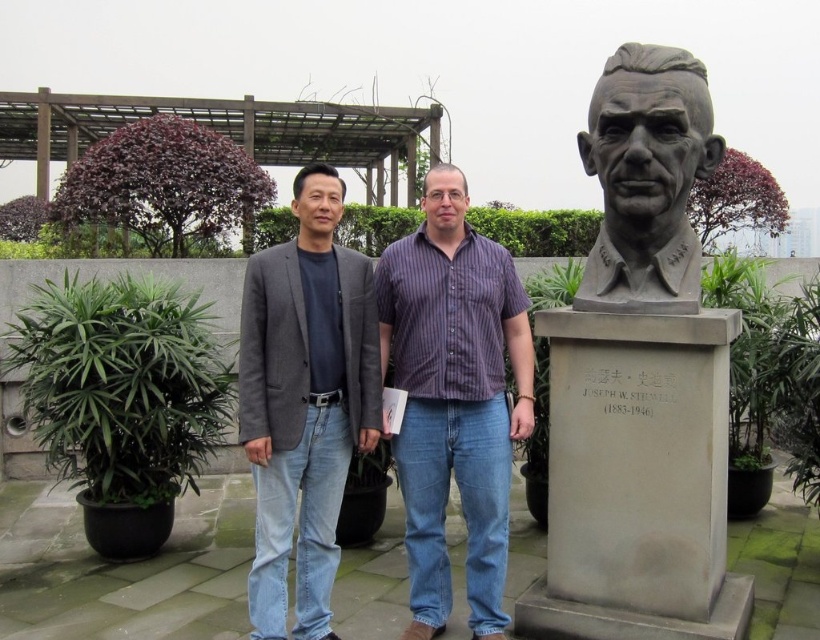
You are standing in the garden and want to place a new small potted plant between the two people. The coordinates of the gray stone bust at right are given as point (x=640, y=381). If the potted plant must be placed exactly halfway between the two people, where should you place it?

The coordinates for placing the potted plant exactly halfway between the two people would be the midpoint between their positions. Since the gray stone bust at right is marked at point (x=640, y=381), the midpoint can be calculated by averaging the coordinates of both individuals. However, without specific coordinates for each person, it is not possible to determine the exact midpoint. Please provide the coordinates of both individuals to proceed.

You are a photographer trying to capture both the gray stone bust at right and the purple striped shirt at center in the same frame. Based on their sizes, which object should you focus on to ensure both fit comfortably in the photo?

Since the gray stone bust at right is wider than the purple striped shirt at center, you should focus on the gray stone bust at right to ensure both objects fit comfortably in the photo.